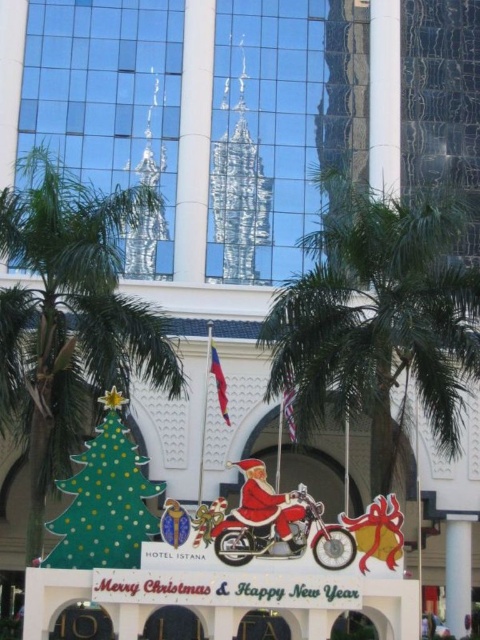
You are standing at the entrance of Hotel Istana and notice a festive display. There is a Santa Claus cutout on a motorcycle, a green Christmas tree with yellow and white polka dots to the left, and a red gift box with a bow to the right. A point labeled with coordinates is located at (105, 499). Based on the scene description, can you determine which festive object the point is part of?

The point labeled with coordinates (105, 499) is part of the green polka dot cardboard Christmas tree at lower left.

You are standing in front of the festive display at Hotel Istana. You notice two points marked in the scene. The first point is at coordinate point(x=433, y=228) and the second is at point(x=81, y=307). Which point is closer to your viewpoint?

Point(x=433, y=228) is closer to the camera than point(x=81, y=307).